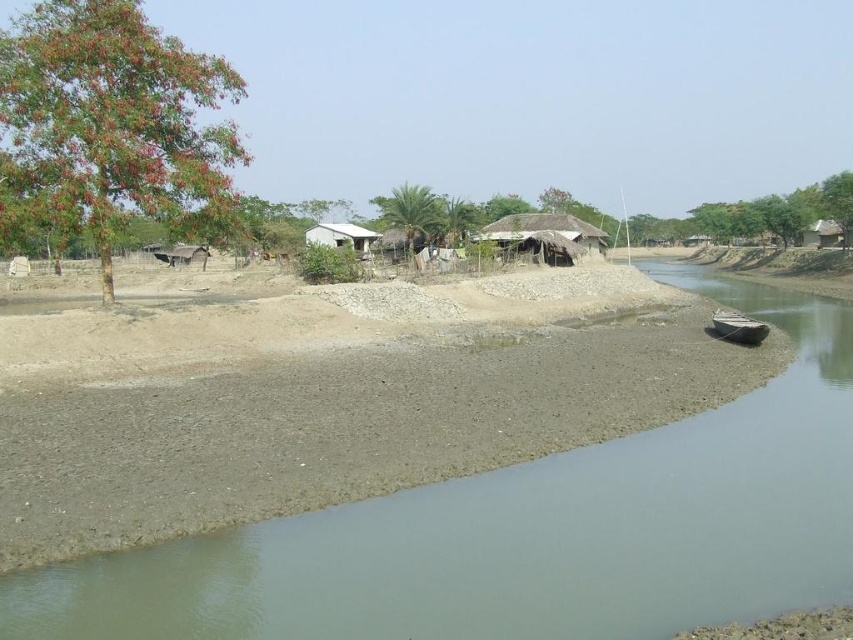
You are standing at the riverside and want to take a photo of the thatched straw hut at center without the green leafy tree at upper left blocking the view. Is this possible?

The green leafy tree at upper left is positioned under the thatched straw hut at center, so it won